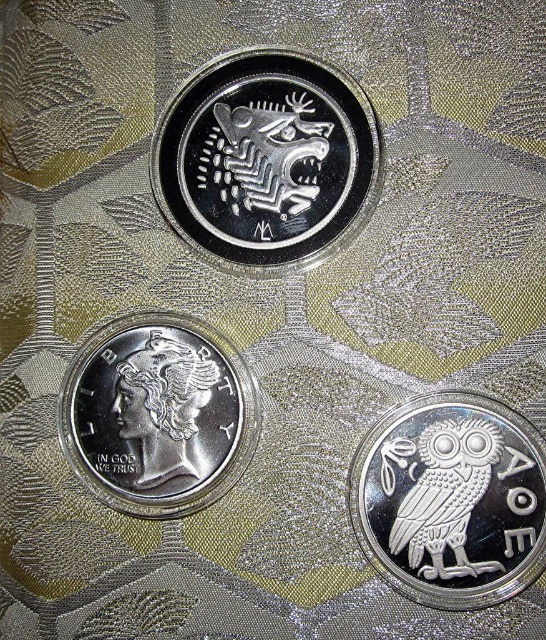
Can you confirm if silver/reflective/animal at upper center is positioned below silver/smooth owl at center?

Incorrect, silver/reflective/animal at upper center is not positioned below silver/smooth owl at center.

Is silver/reflective/animal at upper center wider than silver/smooth owl at center?

Correct, the width of silver/reflective/animal at upper center exceeds that of silver/smooth owl at center.

Who is more distant from viewer, [245,225] or [133,481]?

Point [245,225]

The width and height of the screenshot is (546, 640). What are the coordinates of `silver/reflective/animal at upper center` in the screenshot? It's located at (265, 157).

Does silver/smooth owl at lower right have a greater width compared to satin silver owl at center?

Yes, silver/smooth owl at lower right is wider than satin silver owl at center.

Can you confirm if silver/smooth owl at lower right is positioned below satin silver owl at center?

Indeed, silver/smooth owl at lower right is positioned under satin silver owl at center.

Is point (519, 576) farther from camera compared to point (491, 442)?

No, it is not.

This screenshot has height=640, width=546. Identify the location of silver/smooth owl at lower right. (452, 499).

Is silver/metallic liberty at center smaller than satin silver owl at center?

Actually, silver/metallic liberty at center might be larger than satin silver owl at center.

You are a GUI agent. You are given a task and a screenshot of the screen. Output one action in this format:
    pyautogui.click(x=<x>, y=<y>)
    Task: Click on the silver/metallic liberty at center
    This screenshot has height=640, width=546.
    Given the screenshot: What is the action you would take?
    pyautogui.click(x=157, y=413)

You are a GUI agent. You are given a task and a screenshot of the screen. Output one action in this format:
    pyautogui.click(x=<x>, y=<y>)
    Task: Click on the silver/metallic liberty at center
    The height and width of the screenshot is (640, 546).
    Given the screenshot: What is the action you would take?
    pyautogui.click(x=157, y=413)